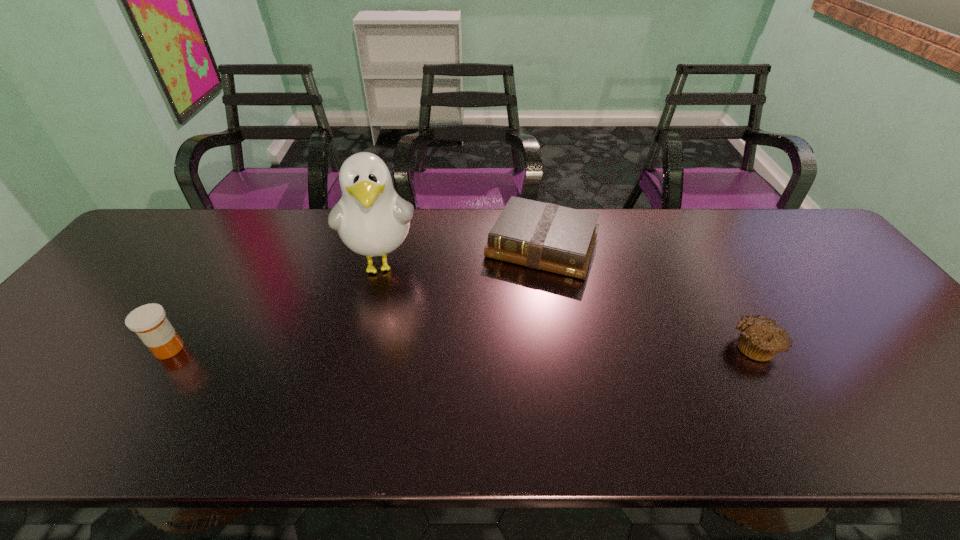
This screenshot has width=960, height=540. Find the location of `free region located 0.240m on the spine side of the Bible`. free region located 0.240m on the spine side of the Bible is located at coordinates (500, 344).

This screenshot has height=540, width=960. Find the location of `free space located 0.160m on the beak of the third object from right to left`. free space located 0.160m on the beak of the third object from right to left is located at coordinates (381, 343).

The width and height of the screenshot is (960, 540). In order to click on blank area located 0.090m on the beak of the third object from right to left in this screenshot , I will do tap(381, 322).

I want to click on vacant space located 0.210m on the beak of the third object from right to left, so click(381, 360).

Where is `Bible that is at the far edge`? This screenshot has height=540, width=960. Bible that is at the far edge is located at coordinates (545, 236).

Locate an element on the screen. gull that is at the far edge is located at coordinates (371, 219).

Find the location of a particular element. free space at the far edge of the desktop is located at coordinates (674, 237).

The image size is (960, 540). In order to click on vacant space at the near edge of the desktop in this screenshot , I will do `click(727, 383)`.

Where is `free space at the left edge`? The image size is (960, 540). free space at the left edge is located at coordinates (85, 304).

Find the location of a particular element. This screenshot has width=960, height=540. vacant space at the right edge is located at coordinates (808, 274).